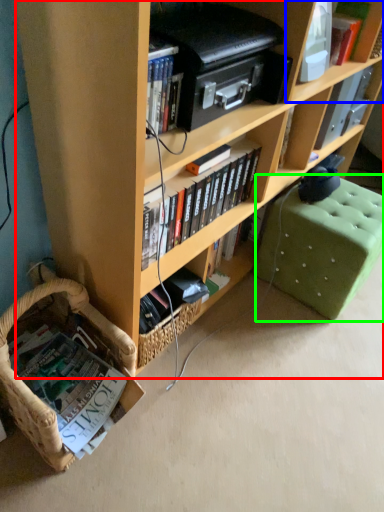
Question: Which object is the farthest from bookcase (highlighted by a red box)? Choose among these: shelf (highlighted by a blue box) or swivel chair (highlighted by a green box).

Choices:
 (A) shelf
 (B) swivel chair

Answer: (A)